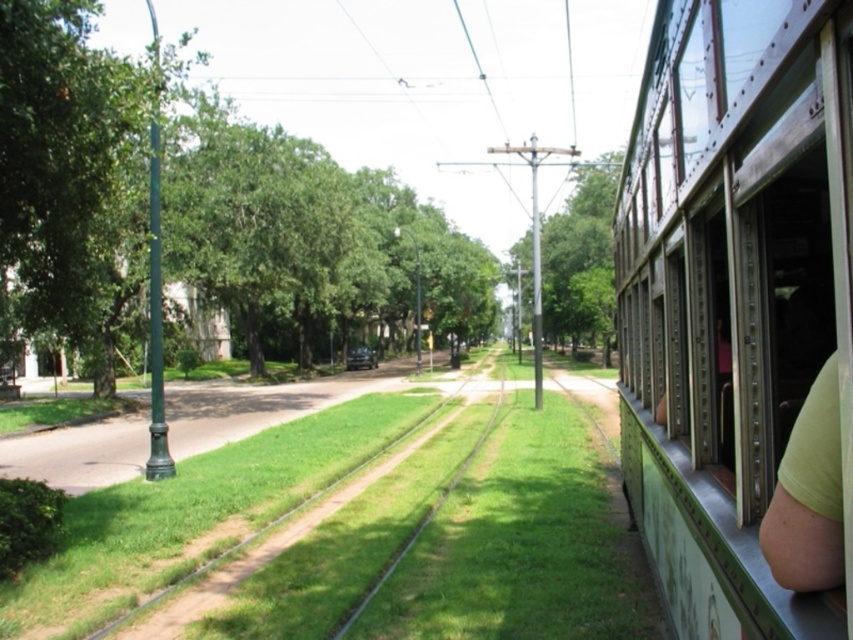
Which of these two, green painted metal train at right or green fabric arm at right, stands shorter?

Standing shorter between the two is green painted metal train at right.

Is green painted metal train at right positioned behind green fabric arm at right?

That is True.

The width and height of the screenshot is (853, 640). Describe the element at coordinates (730, 292) in the screenshot. I see `green painted metal train at right` at that location.

You are a GUI agent. You are given a task and a screenshot of the screen. Output one action in this format:
    pyautogui.click(x=<x>, y=<y>)
    Task: Click on the green painted metal train at right
    The width and height of the screenshot is (853, 640).
    Given the screenshot: What is the action you would take?
    pyautogui.click(x=730, y=292)